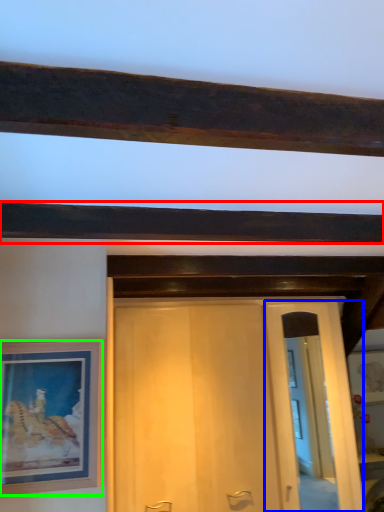
Question: Estimate the real-world distances between objects in this image. Which object is farther from plank (highlighted by a red box), glass door (highlighted by a blue box) or picture frame (highlighted by a green box)?

Choices:
 (A) glass door
 (B) picture frame

Answer: (A)